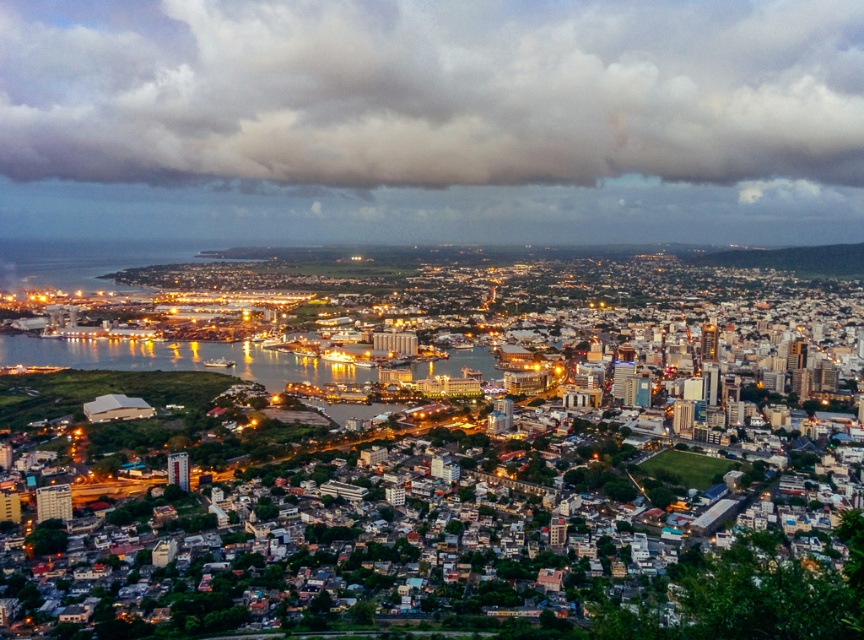
Does matte urban landscape at lower left appear over gray cotton cloud at upper center?

No, matte urban landscape at lower left is not above gray cotton cloud at upper center.

Does matte urban landscape at lower left have a smaller size compared to gray cotton cloud at upper center?

No.

Find the location of `matte urban landscape at lower left`. matte urban landscape at lower left is located at coordinates (446, 419).

In order to click on matte urban landscape at lower left in this screenshot , I will do `click(446, 419)`.